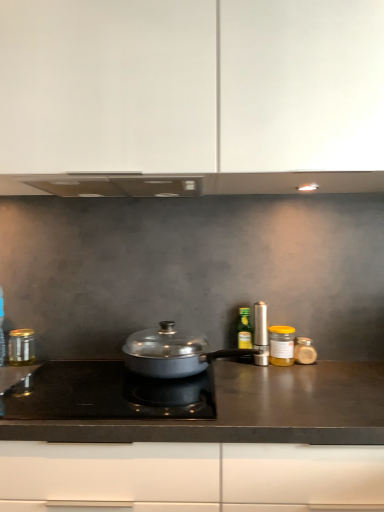
Question: Is black matte countertop at center to the left or to the right of yellow glass jar at right, the 5th kitchen appliance positioned from the left, in the image?

Choices:
 (A) right
 (B) left

Answer: (B)

Question: In terms of height, does black matte countertop at center look taller or shorter compared to yellow glass jar at right, the 5th kitchen appliance positioned from the left?

Choices:
 (A) short
 (B) tall

Answer: (B)

Question: Considering the real-world distances, which object is farthest from the silver metallic salt shaker at right, the 3th kitchen appliance positioned from the right?

Choices:
 (A) yellow glass jar at right, the 5th kitchen appliance positioned from the left
 (B) black matte countertop at center
 (C) translucent glass jar at right, which is the first kitchen appliance in right-to-left order
 (D) white matte cabinet at upper center
 (E) black glass cooktop at center

Answer: (D)

Question: Estimate the real-world distances between objects in this image. Which object is farther from the white matte cabinet at upper center?

Choices:
 (A) silver metallic salt shaker at right, the 3th kitchen appliance positioned from the right
 (B) black glass cooktop at center
 (C) metallic silver canister at center right, which is the fourth kitchen appliance in right-to-left order
 (D) yellow glass jar at right, marked as the second kitchen appliance in a right-to-left arrangement
 (E) matte silver pan at center, which appears as the second kitchen appliance when viewed from the left

Answer: (D)